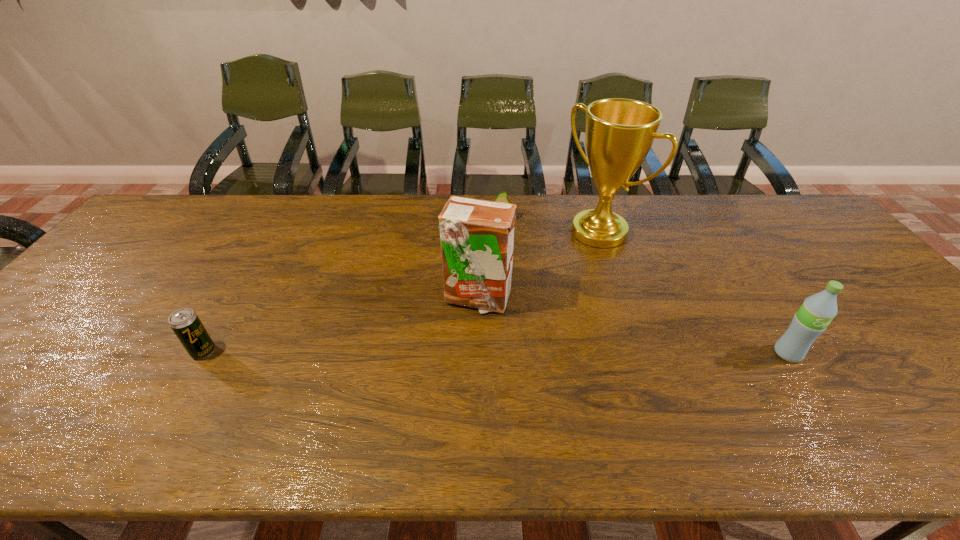
This screenshot has width=960, height=540. Identify the location of vacant space located 0.140m on the cut side of the avocado. (501, 250).

You are a GUI agent. You are given a task and a screenshot of the screen. Output one action in this format:
    pyautogui.click(x=<x>, y=<y>)
    Task: Click on the free point located 0.270m on the cut side of the avocado
    The width and height of the screenshot is (960, 540).
    Given the screenshot: What is the action you would take?
    pyautogui.click(x=503, y=279)

Image resolution: width=960 pixels, height=540 pixels. In order to click on blank space located 0.250m on the cut side of the avocado in this screenshot , I will do point(502,274).

The width and height of the screenshot is (960, 540). I want to click on vacant space located by the handles of the award, so click(521, 287).

Locate an element on the screen. Image resolution: width=960 pixels, height=540 pixels. free space located by the handles of the award is located at coordinates (549, 267).

The image size is (960, 540). I want to click on vacant space located by the handles of the award, so click(x=495, y=305).

Where is `free region located 0.120m on the straw side of the second tallest object`? The image size is (960, 540). free region located 0.120m on the straw side of the second tallest object is located at coordinates click(517, 346).

You are a GUI agent. You are given a task and a screenshot of the screen. Output one action in this format:
    pyautogui.click(x=<x>, y=<y>)
    Task: Click on the free location located 0.060m on the straw side of the second tallest object
    Image resolution: width=960 pixels, height=540 pixels.
    Given the screenshot: What is the action you would take?
    pyautogui.click(x=505, y=329)

Image resolution: width=960 pixels, height=540 pixels. Identify the location of blank area located 0.080m on the straw side of the second tallest object. (509, 335).

Where is `avocado at the far edge`? The height and width of the screenshot is (540, 960). avocado at the far edge is located at coordinates (502, 197).